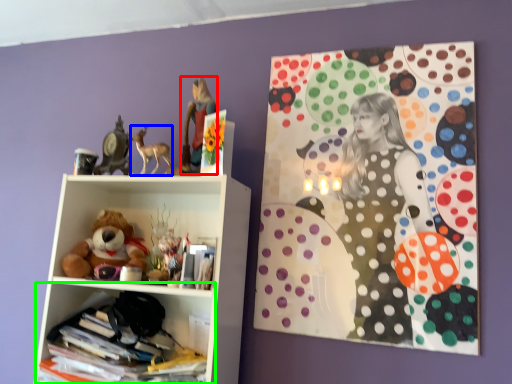
Question: Which object is positioned farthest from girl (highlighted by a red box)? Select from animal (highlighted by a blue box) and shelf (highlighted by a green box).

Choices:
 (A) animal
 (B) shelf

Answer: (B)